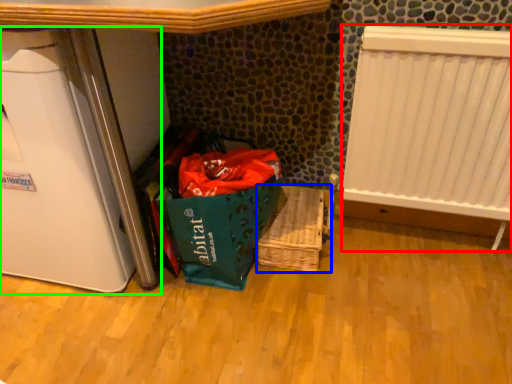
Question: Which object is the farthest from radiator (highlighted by a red box)? Choose among these: basket (highlighted by a blue box) or appliance (highlighted by a green box).

Choices:
 (A) basket
 (B) appliance

Answer: (B)